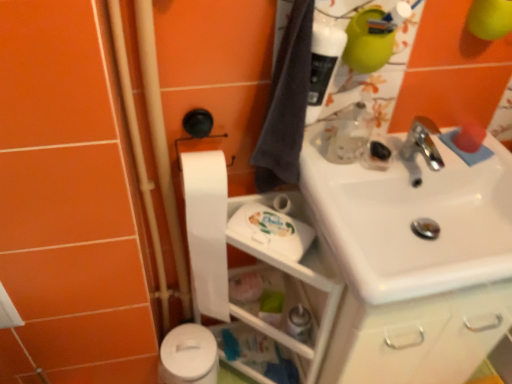
Locate an element on the screen. The image size is (512, 384). blank area beneath white glossy sink at upper right (from a real-world perspective) is located at coordinates (429, 229).